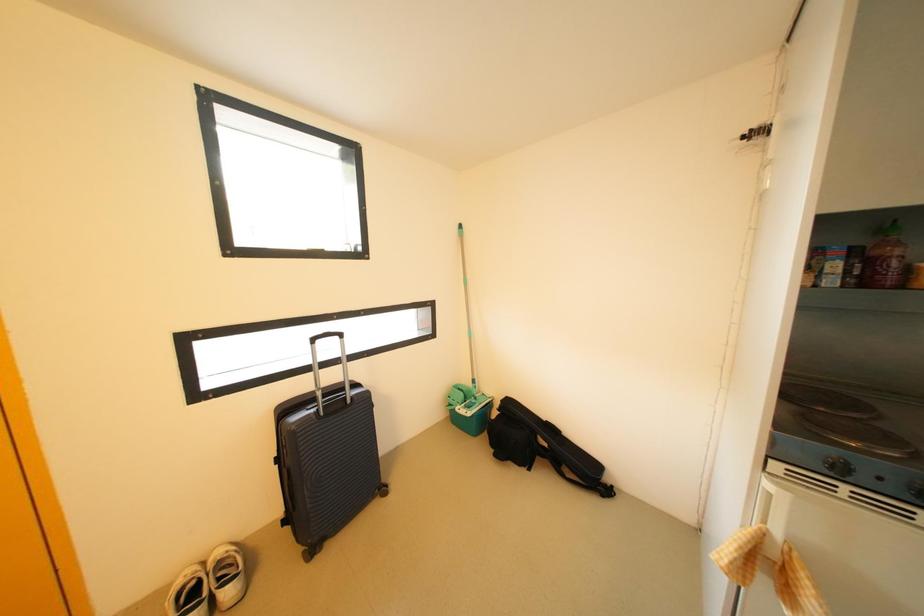
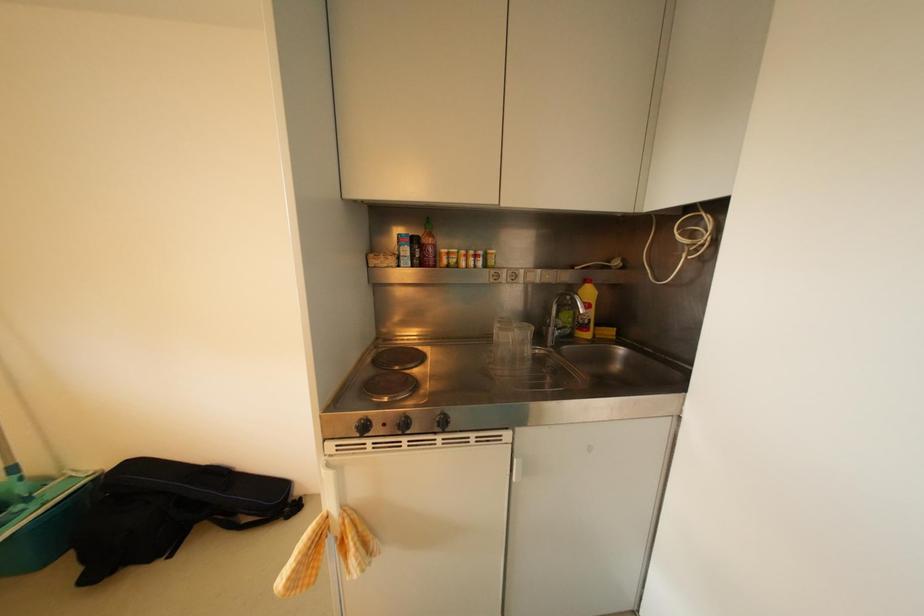
Question: The first image is from the beginning of the video and the second image is from the end. How did the camera likely rotate when shooting the video?

Choices:
 (A) Left
 (B) Right
 (C) Up
 (D) Down

Answer: (B)